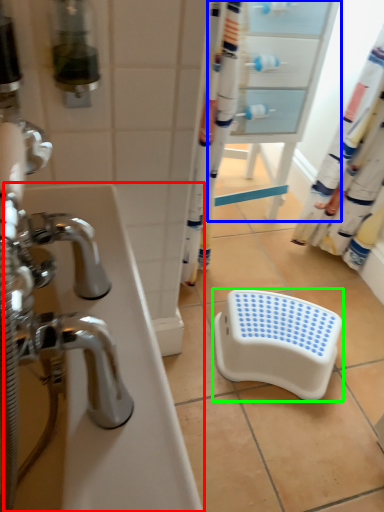
Question: Which object is positioned closest to bath (highlighted by a red box)? Select from screen door (highlighted by a blue box) and step stool (highlighted by a green box).

Choices:
 (A) screen door
 (B) step stool

Answer: (B)